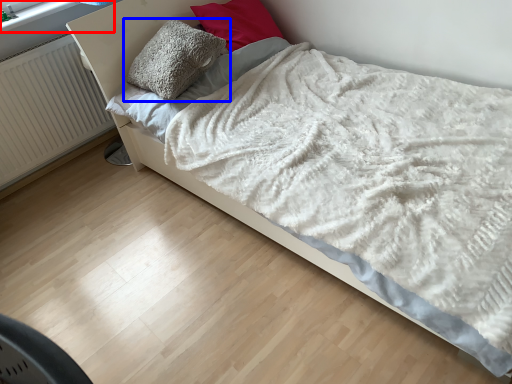
Question: Which object is closer to the camera taking this photo, window frame (highlighted by a red box) or pillow (highlighted by a blue box)?

Choices:
 (A) window frame
 (B) pillow

Answer: (B)